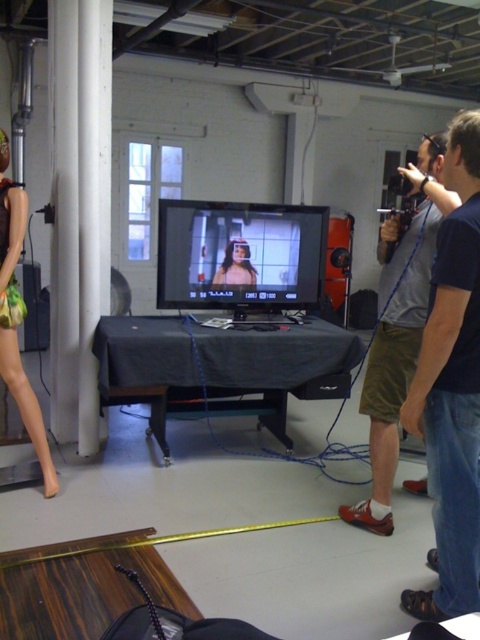
Question: Among these points, which one is nearest to the camera?

Choices:
 (A) (478, 211)
 (B) (242, 266)
 (C) (17, 324)

Answer: (A)

Question: Which point is farther to the camera?

Choices:
 (A) matte black woman at center
 (B) matte plastic mannequin at left

Answer: (A)

Question: Is jeans at right to the left of matte black woman at center from the viewer's perspective?

Choices:
 (A) yes
 (B) no

Answer: (B)

Question: Among these points, which one is farthest from the camera?

Choices:
 (A) (423, 433)
 (B) (230, 253)
 (C) (44, 486)
 (D) (396, 236)

Answer: (B)

Question: Is matte plastic mannequin at left smaller than matte black woman at center?

Choices:
 (A) no
 (B) yes

Answer: (A)

Question: Can you confirm if matte khaki shorts at right is positioned below matte black woman at center?

Choices:
 (A) yes
 (B) no

Answer: (A)